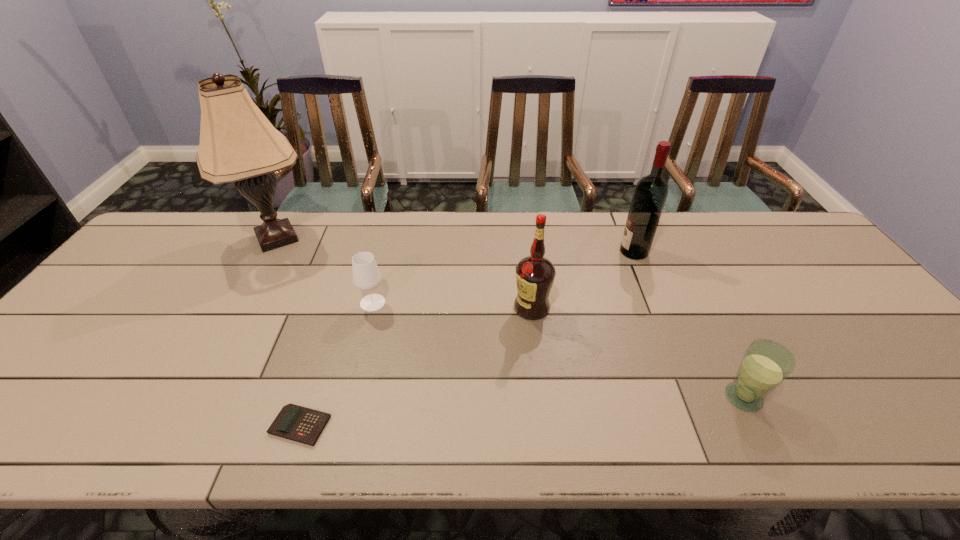
Choose which object is the nearest neighbor to the shortest object. Please provide its 2D coordinates. Your answer should be formatted as a tuple, i.e. [(x, y)], where the tuple contains the x and y coordinates of a point satisfying the conditions above.

[(366, 276)]

The image size is (960, 540). I want to click on vacant space that satisfies the following two spatial constraints: 1. on the front and back of the second tallest object; 2. on the right side of the nearer glass, so click(694, 397).

This screenshot has width=960, height=540. I want to click on vacant space that satisfies the following two spatial constraints: 1. on the back side of the calculator; 2. on the left side of the farther glass, so click(341, 303).

Identify the location of free point that satisfies the following two spatial constraints: 1. on the front side of the right glass; 2. on the left side of the left glass. The height and width of the screenshot is (540, 960). (348, 397).

Locate an element on the screen. Image resolution: width=960 pixels, height=540 pixels. vacant space that satisfies the following two spatial constraints: 1. on the front side of the farther glass; 2. on the right side of the nearer glass is located at coordinates [x=348, y=397].